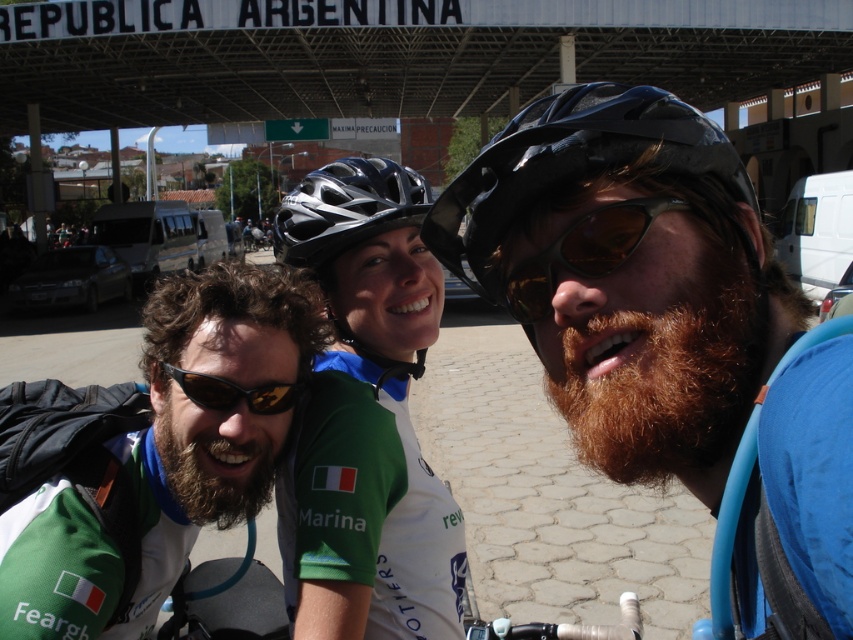
Question: Does green jersey at center come behind brown reflective goggles at center?

Choices:
 (A) no
 (B) yes

Answer: (B)

Question: Is matte blue helmet at center to the left of black matte helmet at center from the viewer's perspective?

Choices:
 (A) yes
 (B) no

Answer: (B)

Question: Which point is closer to the camera?

Choices:
 (A) brownwoollybeard at center
 (B) black matte bicycle helmet at center
 (C) reddish-brown fuzzy beard at center
 (D) brown reflective goggles at center

Answer: (C)

Question: Which point appears farthest from the camera in this image?

Choices:
 (A) (463, 282)
 (B) (393, 269)
 (C) (567, 225)

Answer: (B)

Question: Which object is positioned farthest from the black matte helmet at center?

Choices:
 (A) black matte bicycle helmet at center
 (B) green fabric jersey at center
 (C) reddish-brown fuzzy beard at center
 (D) shiny black helmet at center

Answer: (C)

Question: Can you confirm if green fabric jersey at center is wider than shiny black helmet at center?

Choices:
 (A) yes
 (B) no

Answer: (B)